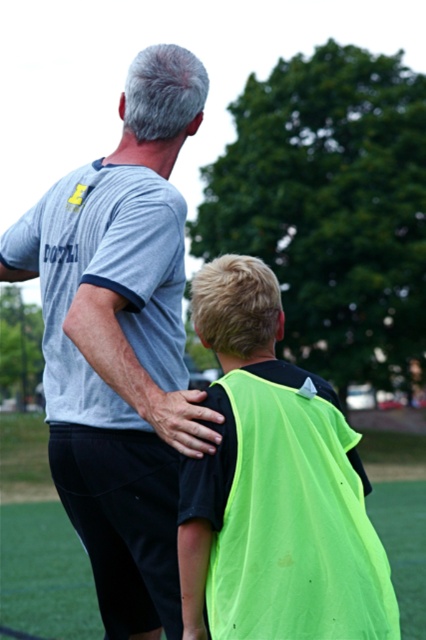
You are standing at the point marked by coordinates point (127,156). You want to take a photo of the two people in the scene using a camera that has a maximum focus range of 5 meters. Will the camera be able to focus on them?

The distance between point (127,156) and the camera is 4.71 meters, which is within the camera maximum focus range of 5 meters. Therefore, the camera can focus on them.